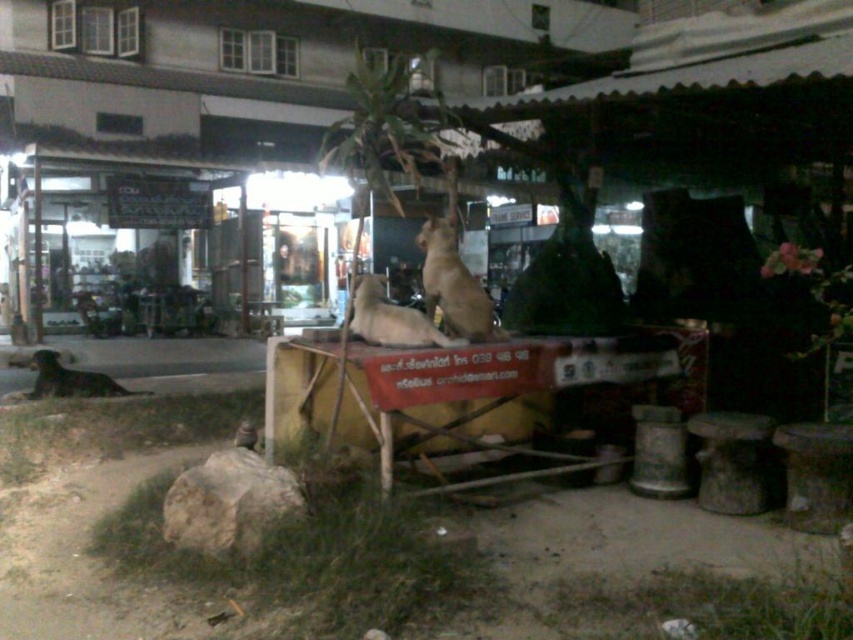
Question: Estimate the real-world distances between objects in this image. Which object is closer to the brown fur dog at center?

Choices:
 (A) brown fur dog at lower left
 (B) fuzzy beige dog at center

Answer: (B)

Question: Is fuzzy beige dog at center thinner than brown fur dog at lower left?

Choices:
 (A) yes
 (B) no

Answer: (A)

Question: Among these objects, which one is farthest from the camera?

Choices:
 (A) brown fur dog at lower left
 (B) fuzzy beige dog at center
 (C) brown fur dog at center

Answer: (A)

Question: Is brown fur dog at center positioned in front of brown fur dog at lower left?

Choices:
 (A) yes
 (B) no

Answer: (A)

Question: Is fuzzy beige dog at center bigger than brown fur dog at lower left?

Choices:
 (A) no
 (B) yes

Answer: (A)

Question: Which point appears closest to the camera in this image?

Choices:
 (A) (490, 317)
 (B) (82, 376)
 (C) (404, 323)

Answer: (C)